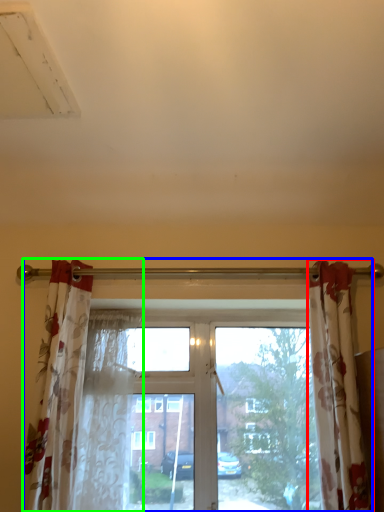
Question: Estimate the real-world distances between objects in this image. Which object is farther from curtain (highlighted by a red box), window (highlighted by a blue box) or curtain (highlighted by a green box)?

Choices:
 (A) window
 (B) curtain

Answer: (B)